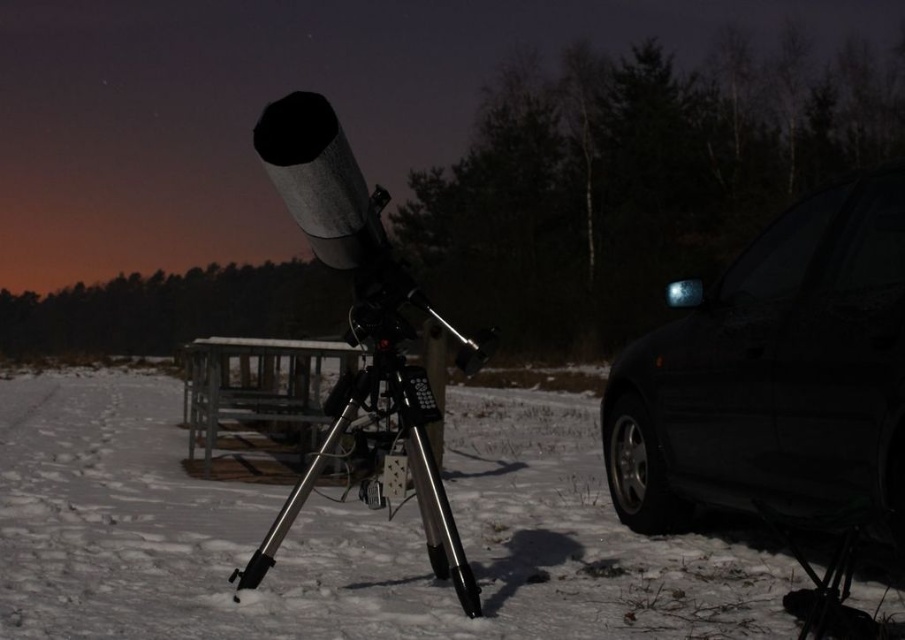
Is white matte snow at center further to the viewer compared to black glossy car at right?

Yes.

Between white matte snow at center and black glossy car at right, which one is positioned higher?

black glossy car at right is above.

Between point (512, 614) and point (641, 460), which one is positioned in front?

Positioned in front is point (512, 614).

I want to click on white matte snow at center, so click(x=341, y=536).

Between point (58, 397) and point (330, 435), which one is positioned behind?

Point (58, 397)

This screenshot has height=640, width=905. Find the location of `white matte snow at center`. white matte snow at center is located at coordinates (341, 536).

Between black glossy car at right and silver metallic tripod at center, which one is positioned higher?

black glossy car at right is above.

Does point (882, 326) come closer to viewer compared to point (451, 554)?

No, (882, 326) is further to viewer.

The height and width of the screenshot is (640, 905). I want to click on black glossy car at right, so click(774, 374).